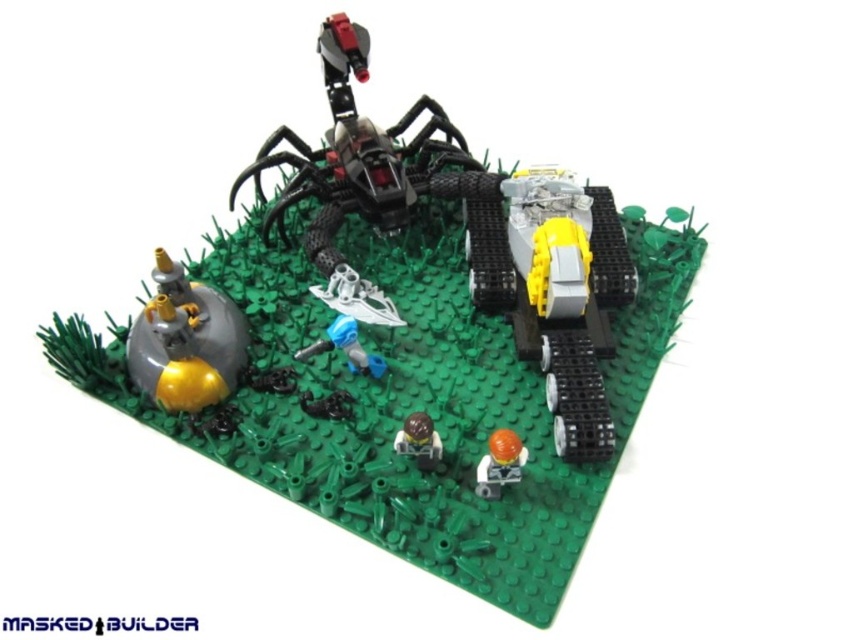
Question: Can you confirm if orange matte minifigure at lower center is positioned above brown matte minifigure at center?

Choices:
 (A) no
 (B) yes

Answer: (A)

Question: Among these objects, which one is farthest from the camera?

Choices:
 (A) brown matte minifigure at center
 (B) orange matte minifigure at lower center

Answer: (A)

Question: Does orange matte minifigure at lower center appear on the left side of brown matte minifigure at center?

Choices:
 (A) yes
 (B) no

Answer: (B)

Question: Among these objects, which one is farthest from the camera?

Choices:
 (A) brown matte minifigure at center
 (B) orange matte minifigure at lower center

Answer: (A)

Question: Is orange matte minifigure at lower center positioned before brown matte minifigure at center?

Choices:
 (A) no
 (B) yes

Answer: (B)

Question: Which point appears farthest from the camera in this image?

Choices:
 (A) (416, 448)
 (B) (503, 481)

Answer: (A)